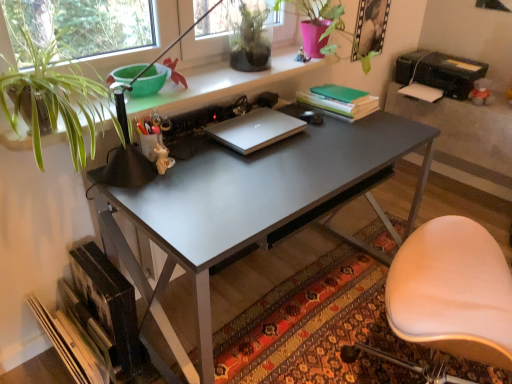
At what (x,y) coordinates should I click in order to perform the action: click on empty space that is in between silver metallic laptop at center and matte white figurine at center. Please return your answer as a coordinate pair (x, y). The image size is (512, 384). Looking at the image, I should click on (202, 156).